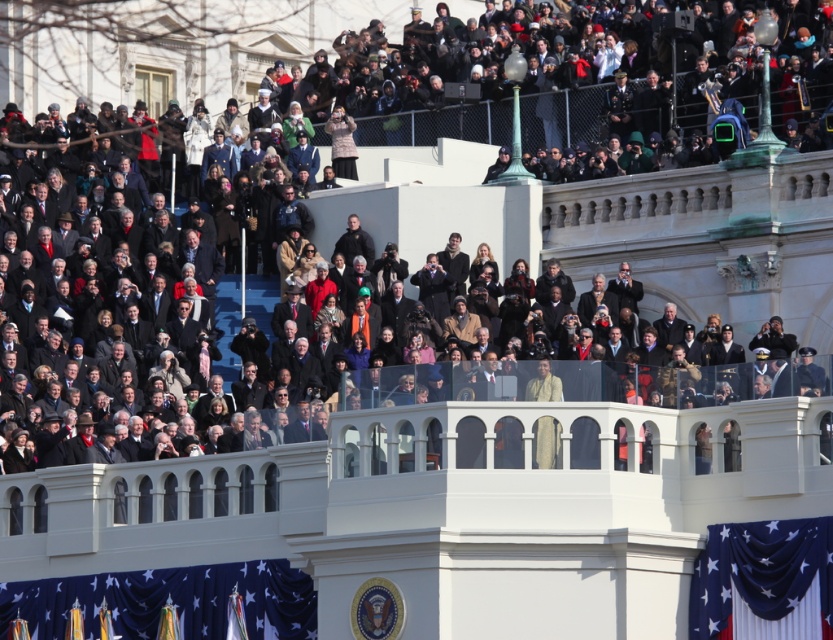
Between blue fabric flag at lower left and blue velvet flag at lower right, which one has more height?

blue fabric flag at lower left

Between point (188, 627) and point (831, 566), which one is positioned behind?

The point (188, 627) is behind.

Find the location of a particular element. blue fabric flag at lower left is located at coordinates (172, 600).